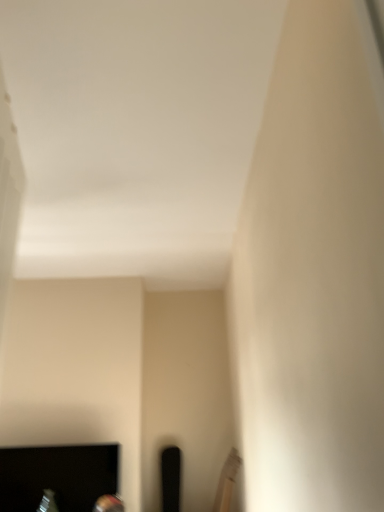
What do you see at coordinates (57, 476) in the screenshot?
I see `metallic silver can at lower left` at bounding box center [57, 476].

I want to click on metallic silver can at lower left, so click(x=57, y=476).

Find the location of a particular element. The width and height of the screenshot is (384, 512). metallic silver can at lower left is located at coordinates (57, 476).